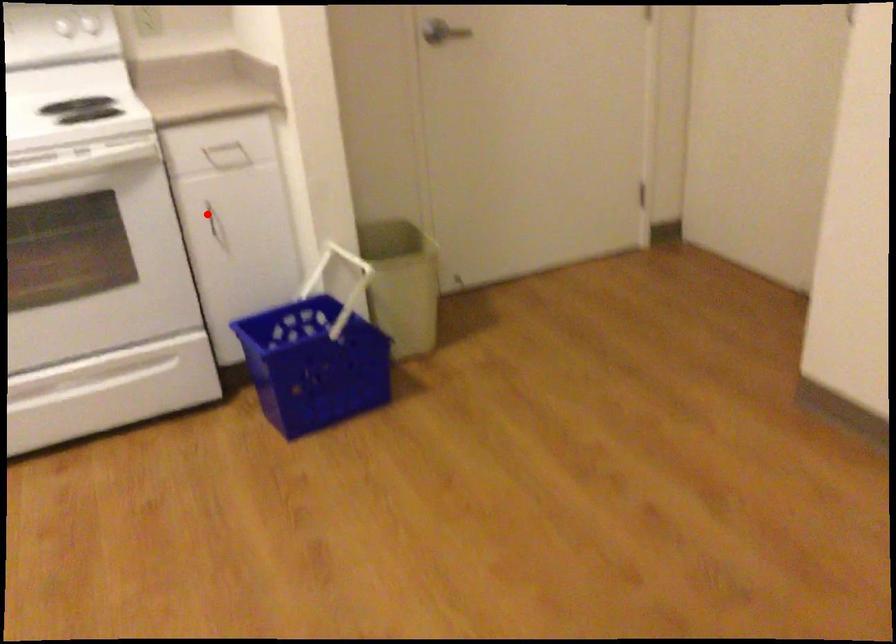
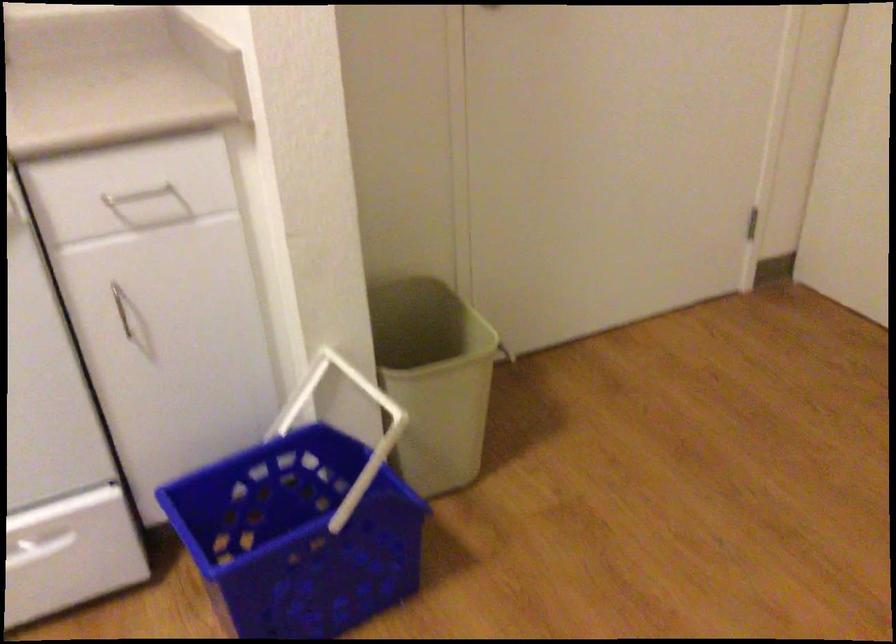
Locate, in the second image, the point that corresponds to the highlighted location in the first image.

(121, 307)